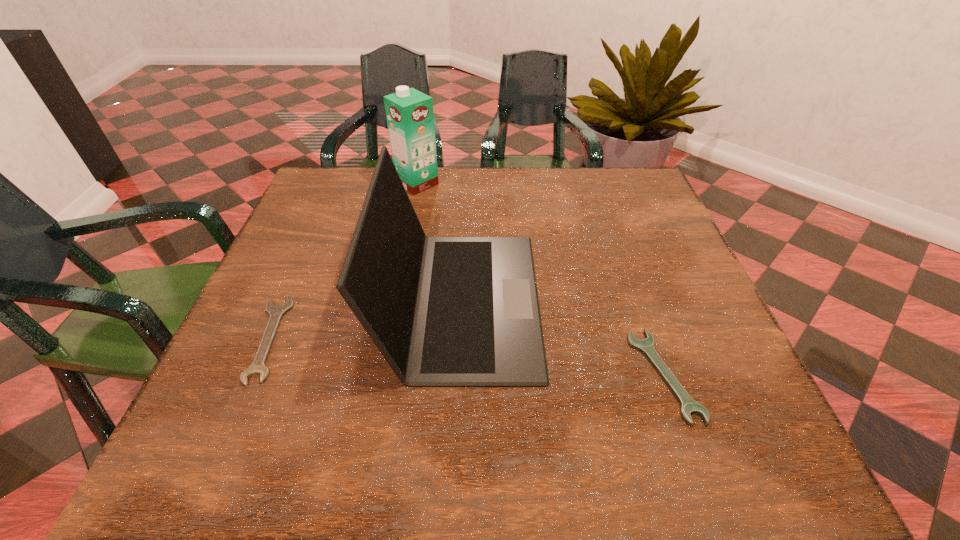
At what (x,y) coordinates should I click in order to perform the action: click on the farthest object. Please return your answer as a coordinate pair (x, y). The width and height of the screenshot is (960, 540). Looking at the image, I should click on (410, 118).

At what (x,y) coordinates should I click in order to perform the action: click on laptop. Please return your answer as a coordinate pair (x, y). Looking at the image, I should click on (443, 311).

The image size is (960, 540). Find the location of `the rightmost object`. the rightmost object is located at coordinates (689, 406).

This screenshot has height=540, width=960. Find the location of `the left wrench`. the left wrench is located at coordinates (276, 312).

I want to click on free space located on the right of the farthest object, so click(x=515, y=184).

Identify the location of vacant space located 0.140m on the screen of the laptop. (606, 301).

Image resolution: width=960 pixels, height=540 pixels. In order to click on blank space located on the back of the rightmost object in this screenshot , I will do `click(608, 215)`.

This screenshot has height=540, width=960. In order to click on vacant space located 0.120m on the right of the left wrench in this screenshot , I will do `click(347, 339)`.

Where is `object at the far edge`? object at the far edge is located at coordinates (410, 118).

Locate an element on the screen. object that is positioned at the near edge is located at coordinates (689, 406).